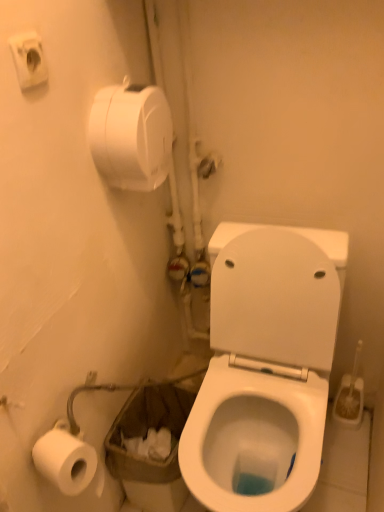
Question: Is the depth of white matte toilet paper at upper left less than that of white glossy toilet at center?

Choices:
 (A) no
 (B) yes

Answer: (A)

Question: Is white matte toilet paper at upper left not within white glossy toilet at center?

Choices:
 (A) no
 (B) yes

Answer: (B)

Question: From the image's perspective, does white matte toilet paper at upper left appear lower than white glossy toilet at center?

Choices:
 (A) no
 (B) yes

Answer: (A)

Question: Is white matte toilet paper at upper left looking in the opposite direction of white glossy toilet at center?

Choices:
 (A) yes
 (B) no

Answer: (B)

Question: Does white matte toilet paper at upper left have a lesser width compared to white glossy toilet at center?

Choices:
 (A) no
 (B) yes

Answer: (B)

Question: Does white matte toilet paper at upper left lie behind white glossy toilet at center?

Choices:
 (A) no
 (B) yes

Answer: (B)

Question: Is white plastic toilet brush at right positioned with its back to white glossy toilet at center?

Choices:
 (A) no
 (B) yes

Answer: (A)

Question: Is white plastic toilet brush at right far from white glossy toilet at center?

Choices:
 (A) yes
 (B) no

Answer: (B)

Question: Is the depth of white plastic toilet brush at right less than that of white glossy toilet at center?

Choices:
 (A) yes
 (B) no

Answer: (B)

Question: From a real-world perspective, is white plastic toilet brush at right on top of white glossy toilet at center?

Choices:
 (A) no
 (B) yes

Answer: (A)

Question: Can you confirm if white plastic toilet brush at right is bigger than white glossy toilet at center?

Choices:
 (A) no
 (B) yes

Answer: (A)

Question: Is white plastic toilet brush at right positioned beyond the bounds of white glossy toilet at center?

Choices:
 (A) no
 (B) yes

Answer: (B)

Question: From the image's perspective, would you say white glossy toilet at center is positioned over white matte toilet paper at upper left?

Choices:
 (A) no
 (B) yes

Answer: (A)